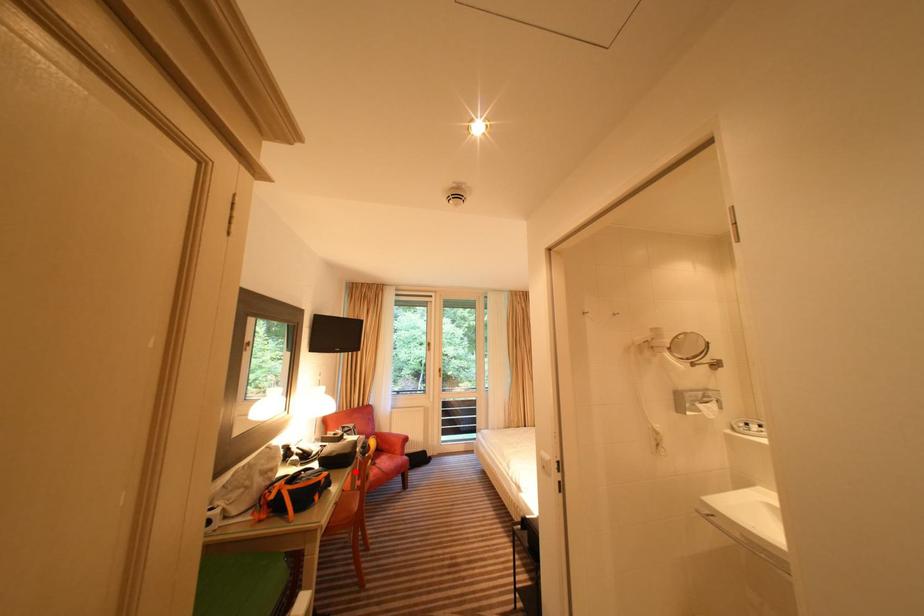
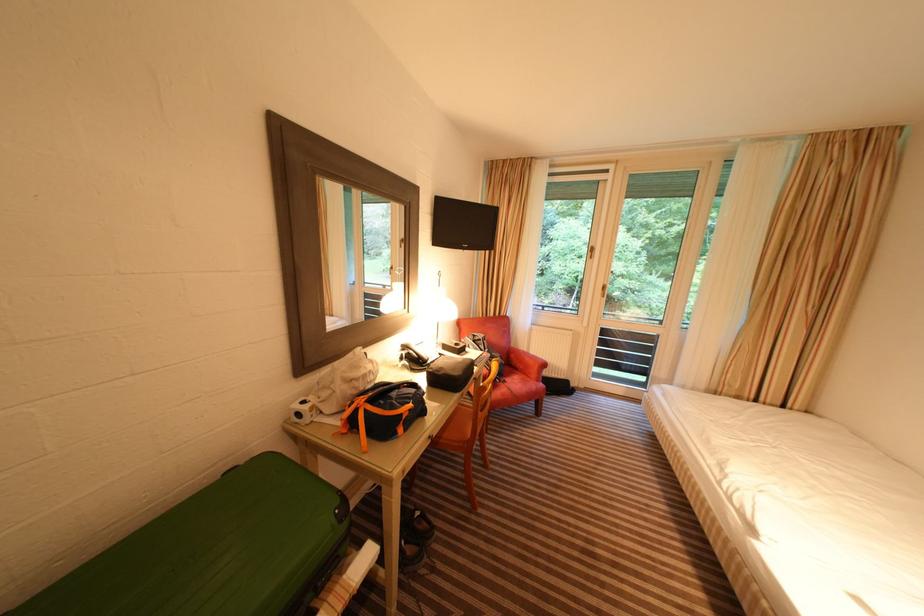
Locate, in the second image, the point that corresponds to the highlighted location in the first image.

(463, 399)